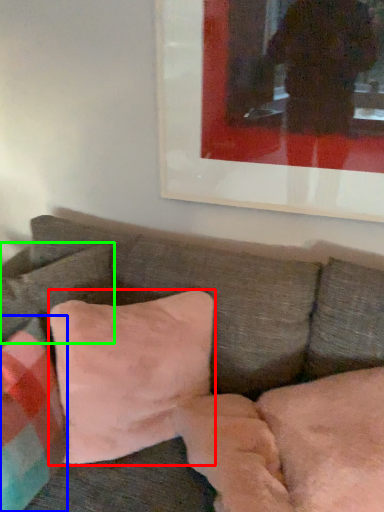
Question: Based on their relative distances, which object is nearer to pillow (highlighted by a red box)? Choose from pillow (highlighted by a blue box) and pillow (highlighted by a green box).

Choices:
 (A) pillow
 (B) pillow

Answer: (A)